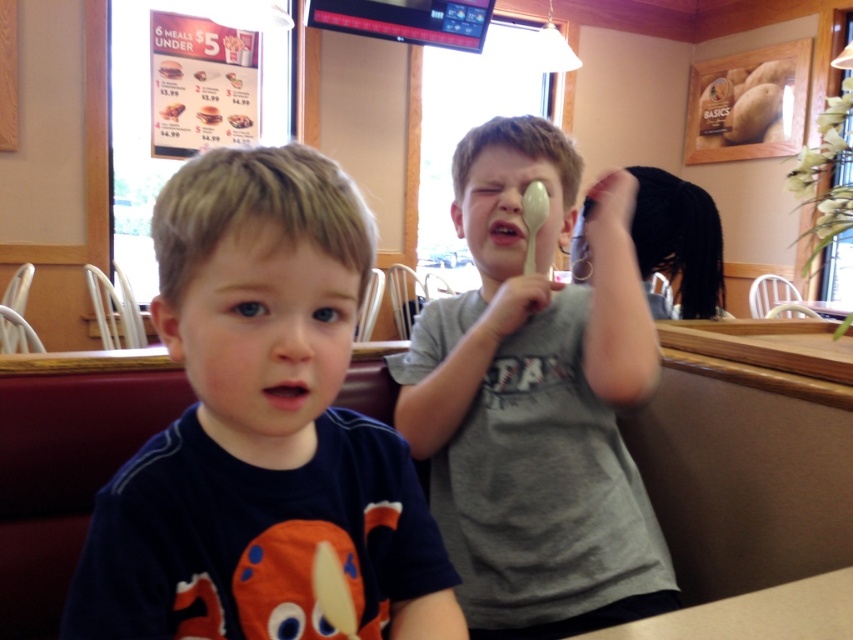
From the picture: You are a server at the restaurant and need to place a 12 inch wide dessert plate on the table. The menu is currently placed on the table. Can the matte gray table at lower center accommodate the dessert plate without moving the white paper menu at upper center?

The matte gray table at lower center is wider than the white paper menu at upper center. Since the menu is placed on the table, there should be enough space left on the table to place the 12 inch dessert plate without moving the menu.

You are a photographer setting up for a group photo. You need to place a small tripod between the matte gray table at lower center and the white paper menu at upper center. Based on their positions, will the tripod be closer to the table or the menu?

The matte gray table at lower center is closer to the viewer than the white paper menu at upper center, so the tripod will be closer to the table.